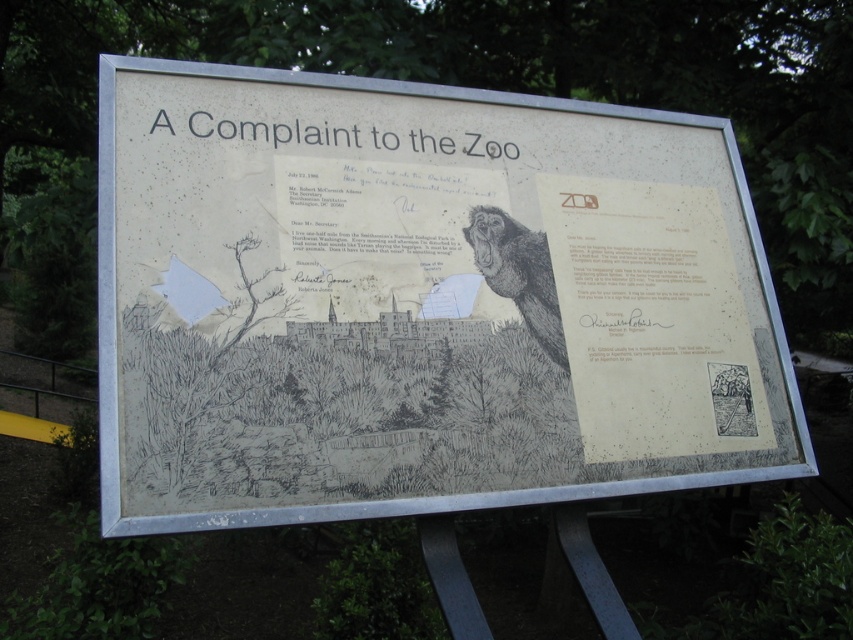
Question: Which object is closer to the camera taking this photo?

Choices:
 (A) black paper at upper center
 (B) white paper sign at center

Answer: (B)

Question: Which point is closer to the camera?

Choices:
 (A) (271, 145)
 (B) (357, 132)

Answer: (A)

Question: Is white paper sign at center closer to the viewer compared to black paper at upper center?

Choices:
 (A) yes
 (B) no

Answer: (A)

Question: Which object appears closest to the camera in this image?

Choices:
 (A) white paper sign at center
 (B) black paper at upper center

Answer: (A)

Question: Observing the image, what is the correct spatial positioning of white paper sign at center in reference to black paper at upper center?

Choices:
 (A) above
 (B) below

Answer: (B)

Question: Is white paper sign at center wider than black paper at upper center?

Choices:
 (A) no
 (B) yes

Answer: (B)